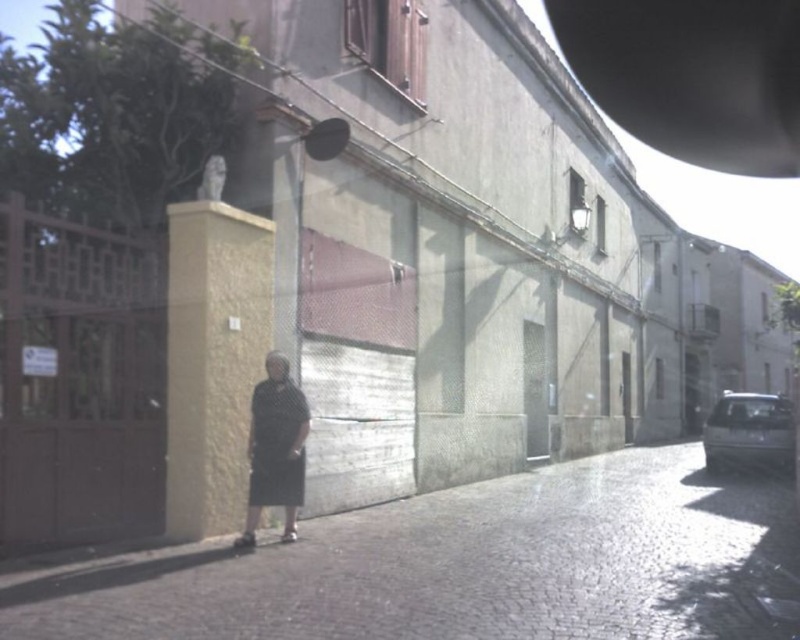
You are a delivery person trying to place a package on the dark gray cobblestone pavement at center. However, there is a black matte dress at lower center in the way. Can you move the dress to the side to access the pavement?

The dark gray cobblestone pavement at center is below the black matte dress at lower center, so you can move the black matte dress at lower center to the side to access the pavement.

You are standing at the point labeled as point (470, 566) in the image. What is the color of the surface you are currently standing on?

The surface at point (470, 566) is dark gray cobblestone pavement.

Based on the scene description, what are the coordinates of the dark gray cobblestone pavement at center?

The coordinates of the dark gray cobblestone pavement at center are at point (x=470, y=566).